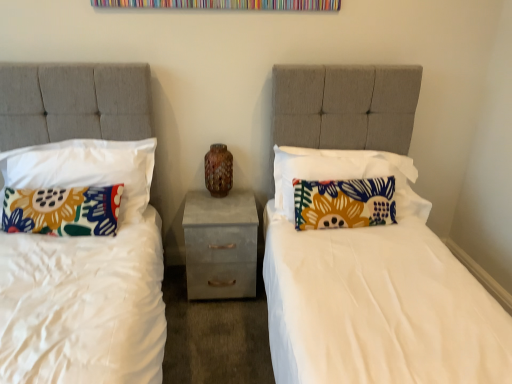
Question: Looking at the image, does floral fabric pillow at right, the fourth pillow in the left-to-right sequence, seem bigger or smaller compared to floral fabric pillow at left, the 1th pillow viewed from the left?

Choices:
 (A) small
 (B) big

Answer: (B)

Question: Considering the positions of floral fabric pillow at right, the fourth pillow in the left-to-right sequence, and floral fabric pillow at left, the 1th pillow viewed from the left, in the image, is floral fabric pillow at right, the fourth pillow in the left-to-right sequence, wider or thinner than floral fabric pillow at left, the 1th pillow viewed from the left,?

Choices:
 (A) thin
 (B) wide

Answer: (B)

Question: Considering the real-world distances, which object is closest to the floral fabric pillow at left, which is the 3th pillow from right to left?

Choices:
 (A) brown speckled vase at center
 (B) concrete textured nightstand at center
 (C) floral fabric pillow at right, which is counted as the 2th pillow, starting from the right
 (D) floral fabric pillow at right, which appears as the 1th pillow when viewed from the right
 (E) floral fabric pillow at left, which is the 4th pillow in right-to-left order

Answer: (E)

Question: Which of these objects is positioned closest to the floral fabric pillow at right, the fourth pillow in the left-to-right sequence?

Choices:
 (A) concrete textured nightstand at center
 (B) floral fabric pillow at right, which is counted as the 3th pillow, starting from the left
 (C) brown speckled vase at center
 (D) floral fabric pillow at left, which is the 4th pillow in right-to-left order
 (E) floral fabric pillow at left, the second pillow viewed from the left

Answer: (B)